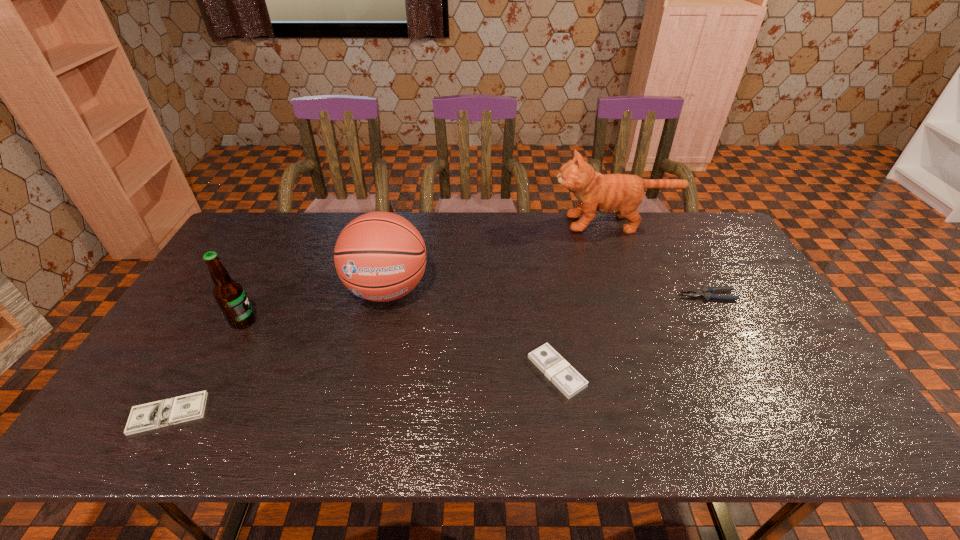
Where is `beer bottle at the left edge`? Image resolution: width=960 pixels, height=540 pixels. beer bottle at the left edge is located at coordinates (229, 294).

You are a GUI agent. You are given a task and a screenshot of the screen. Output one action in this format:
    pyautogui.click(x=<x>, y=<y>)
    Task: Click on the dollar situated at the left edge
    This screenshot has width=960, height=540.
    Given the screenshot: What is the action you would take?
    pyautogui.click(x=157, y=414)

Where is `cat at the right edge`? This screenshot has height=540, width=960. cat at the right edge is located at coordinates (621, 194).

This screenshot has width=960, height=540. I want to click on pliers positioned at the right edge, so click(707, 293).

Where is `object situated at the near left corner`? This screenshot has height=540, width=960. object situated at the near left corner is located at coordinates (157, 414).

In order to click on object located at the far right corner in this screenshot , I will do `click(621, 194)`.

Identify the location of vacant space at the far edge. (330, 250).

You are a GUI agent. You are given a task and a screenshot of the screen. Output one action in this format:
    pyautogui.click(x=<x>, y=<y>)
    Task: Click on the vacant position at the near edge of the desktop
    The image size is (960, 540).
    Given the screenshot: What is the action you would take?
    pyautogui.click(x=466, y=422)

What are the coordinates of `free spot at the left edge of the desktop` in the screenshot? It's located at (164, 385).

Locate an element on the screen. The height and width of the screenshot is (540, 960). free space at the right edge of the desktop is located at coordinates pos(746,311).